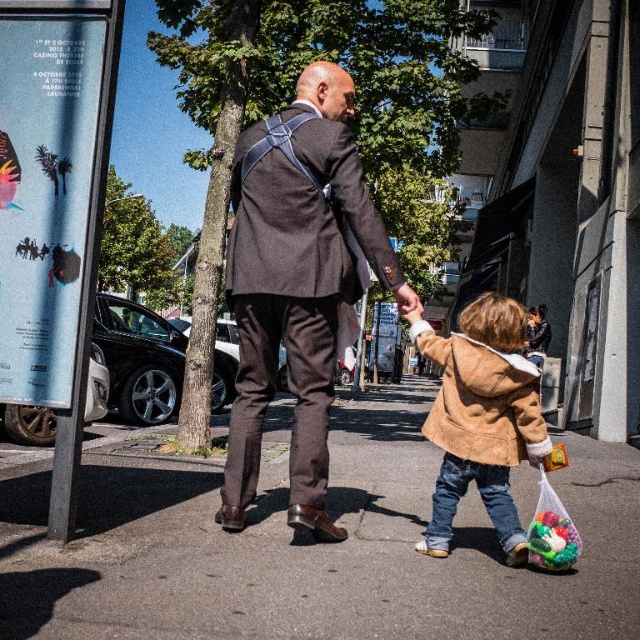
Which is below, matte brown suit at center or blue paper poster at left?

matte brown suit at center is lower down.

Is matte brown suit at center further to camera compared to blue paper poster at left?

Yes, it is.

Who is more forward, (317, 211) or (67, 225)?

Point (67, 225) is in front.

The width and height of the screenshot is (640, 640). Identify the location of matte brown suit at center. (298, 284).

Between point (10, 612) and point (33, 305), which one is positioned behind?

The point (33, 305) is more distant.

How far apart are asphalt at center and blue paper poster at left?

A distance of 7.53 feet exists between asphalt at center and blue paper poster at left.

The width and height of the screenshot is (640, 640). What do you see at coordinates (312, 547) in the screenshot?
I see `asphalt at center` at bounding box center [312, 547].

Where is `asphalt at center`? asphalt at center is located at coordinates (312, 547).

Does matte brown suit at center have a greater width compared to tan suede jacket at lower right?

No, matte brown suit at center is not wider than tan suede jacket at lower right.

The image size is (640, 640). What do you see at coordinates (298, 284) in the screenshot?
I see `matte brown suit at center` at bounding box center [298, 284].

Find the location of a particular element. matte brown suit at center is located at coordinates (298, 284).